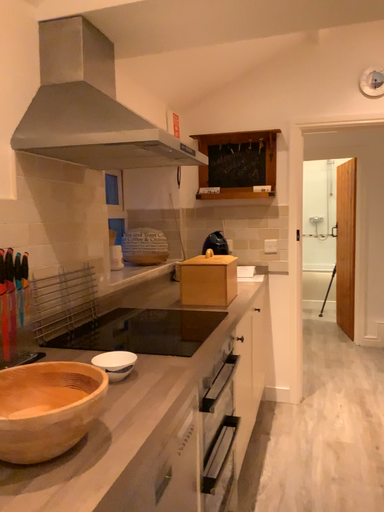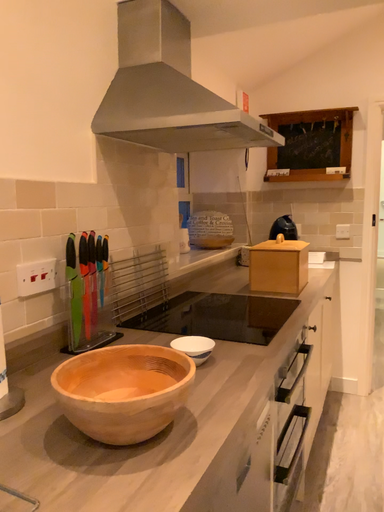
Question: How did the camera likely rotate when shooting the video?

Choices:
 (A) rotated right
 (B) rotated left

Answer: (B)